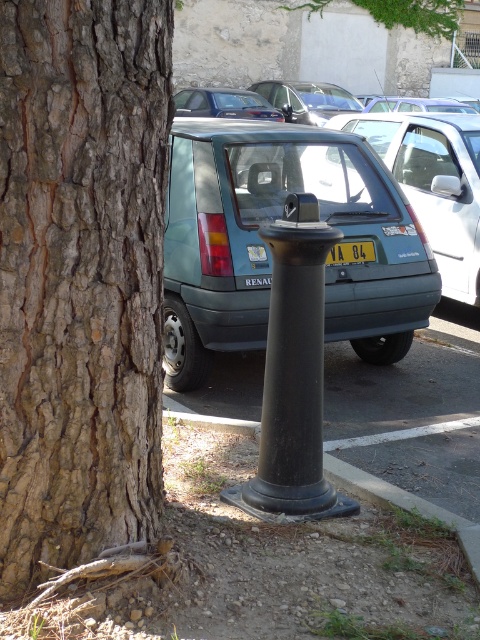
Question: Can you confirm if brown rough bark at left is positioned above black rubber post at lower center?

Choices:
 (A) no
 (B) yes

Answer: (B)

Question: Is brown rough bark at left positioned behind yellow plastic license plate at center?

Choices:
 (A) yes
 (B) no

Answer: (B)

Question: Which point is farther to the camera?

Choices:
 (A) brown rough bark at left
 (B) black matte pole at center
 (C) black rubber post at lower center

Answer: (B)

Question: Considering the real-world distances, which object is farthest from the black matte pole at center?

Choices:
 (A) matte green car at center
 (B) brown rough bark at left
 (C) yellow plastic license plate at center
 (D) black rubber post at lower center

Answer: (A)

Question: Which point appears closest to the camera in this image?

Choices:
 (A) (201, 419)
 (B) (336, 244)

Answer: (B)

Question: Is the position of teal matte hatchback at center more distant than that of black rubber post at lower center?

Choices:
 (A) yes
 (B) no

Answer: (A)